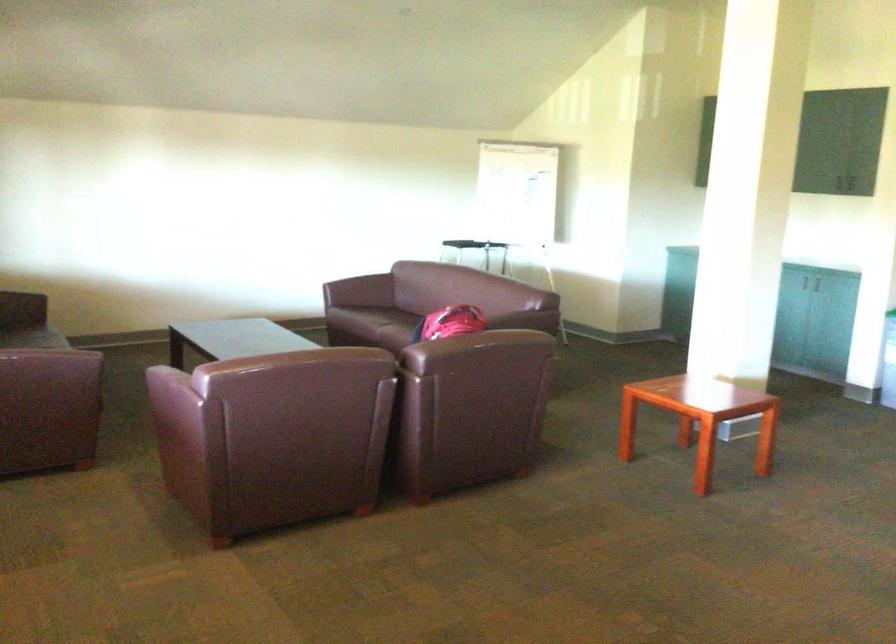
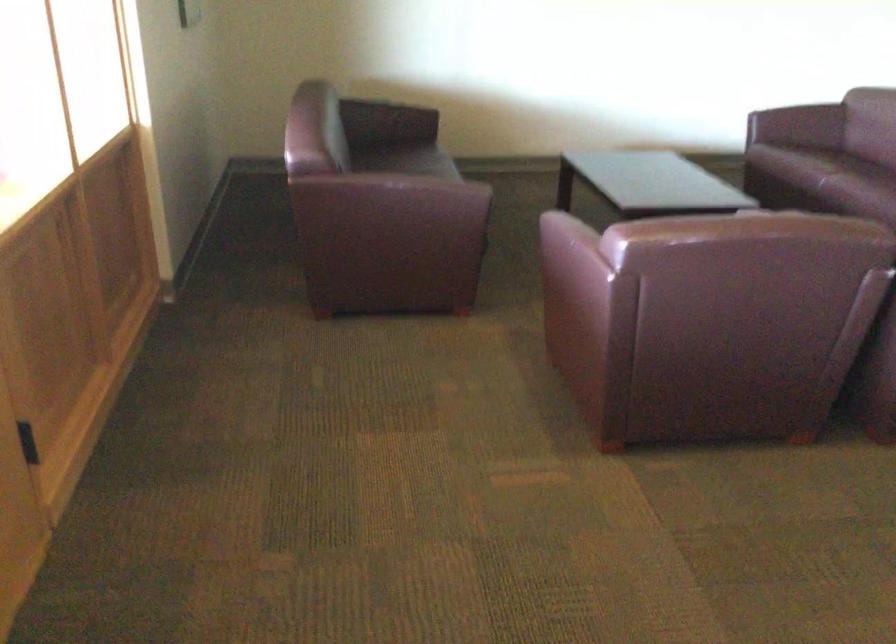
Based on the continuous images, in which direction is the camera rotating?

The rotation direction of the camera is right-down.